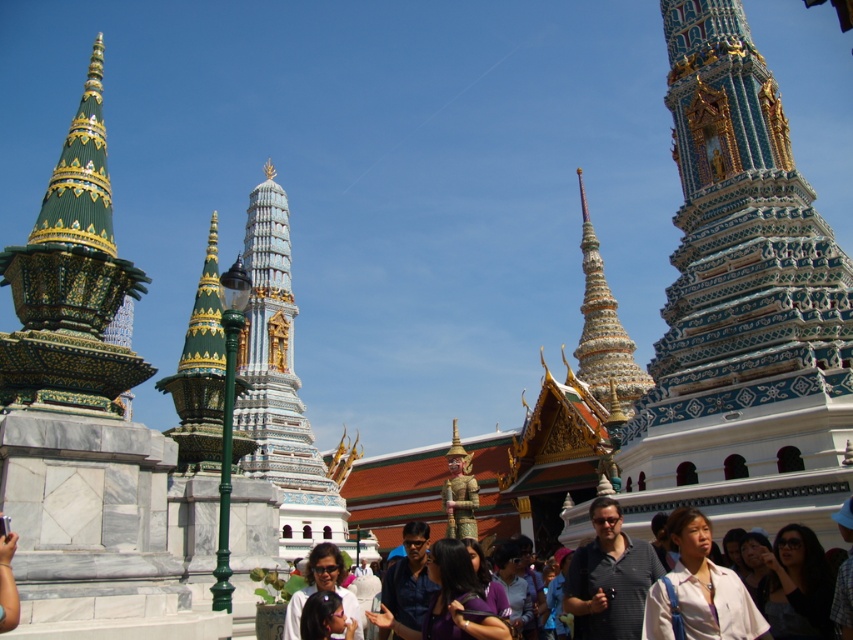
You are standing at the temple complex and want to take a photo that includes both the central spire and the group of tourists. The central spire is at point (32,401) and the tourists are at point (326,582). Which point should you focus on first to ensure both are in focus?

You should focus on point (32,401) first because it is closer to the camera than point (326,582), ensuring both will be in focus when using depth of field.